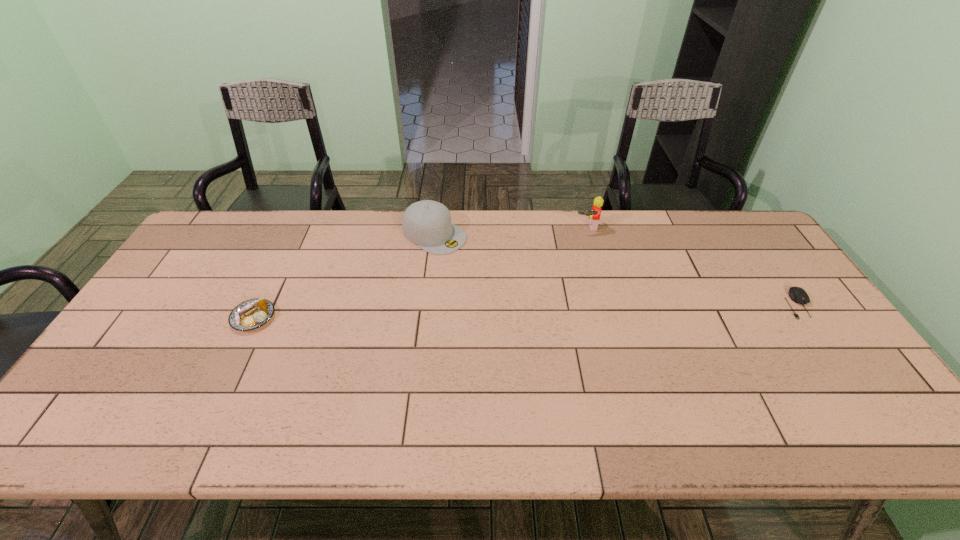
Locate an element on the screen. This screenshot has height=540, width=960. empty space that is in between the rightmost object and the third shortest object is located at coordinates (615, 269).

Find the location of a particular element. This screenshot has height=540, width=960. empty location between the mouse and the leftmost object is located at coordinates (525, 310).

Locate an element on the screen. vacant region between the second object from right to left and the shortest object is located at coordinates (692, 265).

At what (x,y) coordinates should I click in order to perform the action: click on empty space between the mouse and the third tallest object. Please return your answer as a coordinate pair (x, y). This screenshot has width=960, height=540. Looking at the image, I should click on (525, 310).

Where is `free area in between the tallest object and the shortest object`? This screenshot has height=540, width=960. free area in between the tallest object and the shortest object is located at coordinates (692, 265).

The image size is (960, 540). What are the coordinates of `object that stands as the third closest to the pastry` in the screenshot? It's located at (798, 295).

Where is `the second closest object to the Lego`? The height and width of the screenshot is (540, 960). the second closest object to the Lego is located at coordinates (798, 295).

Find the location of a particular element. This screenshot has width=960, height=540. free space that satisfies the following two spatial constraints: 1. on the back side of the leftmost object; 2. on the right side of the mouse is located at coordinates coord(260,303).

This screenshot has height=540, width=960. What are the coordinates of `vacant space that satisfies the following two spatial constraints: 1. on the back side of the third tallest object; 2. on the left side of the tallest object` in the screenshot? It's located at (298, 227).

Identify the location of free location that satisfies the following two spatial constraints: 1. on the front side of the rightmost object; 2. on the left side of the cap. (426, 303).